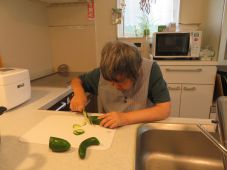
You are a GUI agent. You are given a task and a screenshot of the screen. Output one action in this format:
    pyautogui.click(x=<x>, y=<y>)
    Task: Click on the cutting board
    
    Given the screenshot: What is the action you would take?
    pyautogui.click(x=47, y=125)